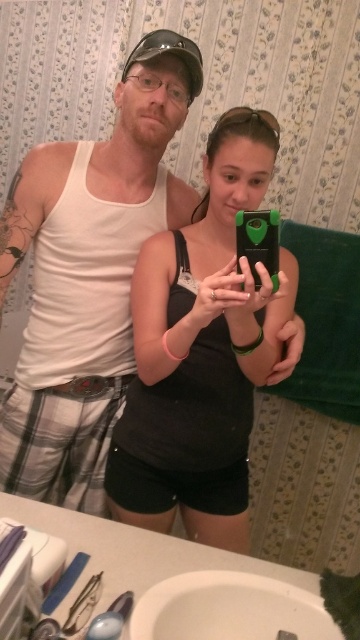
Is matte black tank top at center above white ceramic sink at lower center?

Yes.

Between matte black tank top at center and white ceramic sink at lower center, which one has less height?

With less height is white ceramic sink at lower center.

Between point (209, 360) and point (291, 589), which one is positioned behind?

Positioned behind is point (209, 360).

Find the location of `matte black tank top at center`. matte black tank top at center is located at coordinates (203, 352).

Does white matte tank top at upper left have a lesser height compared to white ceramic sink at lower center?

No, white matte tank top at upper left is not shorter than white ceramic sink at lower center.

Is white matte tank top at upper left to the left of white ceramic sink at lower center from the viewer's perspective?

Correct, you'll find white matte tank top at upper left to the left of white ceramic sink at lower center.

Which is behind, point (190, 90) or point (212, 632)?

The point (190, 90) is more distant.

Locate an element on the screen. Image resolution: width=360 pixels, height=640 pixels. white matte tank top at upper left is located at coordinates (88, 275).

Can you confirm if white matte tank top at upper left is wider than matte black tank top at center?

Indeed, white matte tank top at upper left has a greater width compared to matte black tank top at center.

Who is more forward, (164, 204) or (226, 435)?

Point (226, 435) is in front.

This screenshot has height=640, width=360. In order to click on white matte tank top at upper left in this screenshot , I will do `click(88, 275)`.